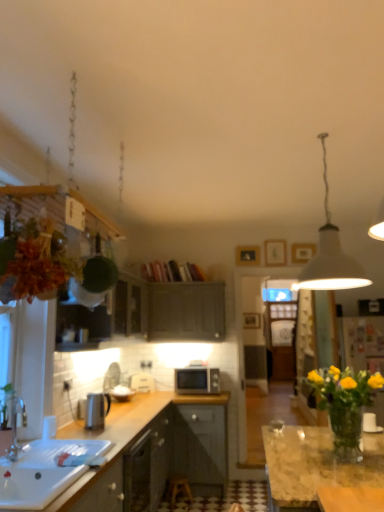
Locate an element on the screen. This screenshot has width=384, height=512. vacant space positioned to the left of wooden stool at center is located at coordinates (164, 502).